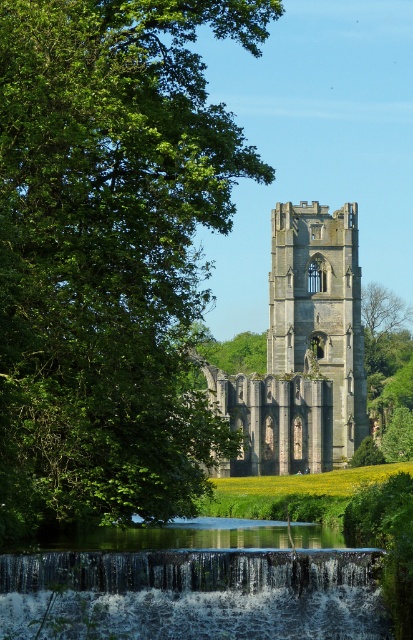
Is point (128, 248) closer to camera compared to point (130, 541)?

Yes, point (128, 248) is in front of point (130, 541).

Who is positioned more to the left, green leafy tree at upper left or translucent water cascade at lower center?

green leafy tree at upper left

Where is `green leafy tree at upper left`? The width and height of the screenshot is (413, 640). green leafy tree at upper left is located at coordinates (109, 252).

This screenshot has width=413, height=640. I want to click on green leafy tree at upper left, so click(x=109, y=252).

Is point (87, 593) farther from viewer compared to point (299, 426)?

No, it is not.

Which is above, translucent water cascade at lower center or stone tower at center?

stone tower at center is above.

Who is more distant from viewer, (40, 634) or (356, 282)?

Positioned behind is point (356, 282).

This screenshot has height=640, width=413. What are the coordinates of `translucent water cascade at lower center` in the screenshot? It's located at (197, 586).

From the picture: Is green leafy tree at upper left taller than stone tower at center?

Correct, green leafy tree at upper left is much taller as stone tower at center.

Does point (68, 163) come behind point (266, 472)?

That is False.

Where is `green leafy tree at upper left`? The height and width of the screenshot is (640, 413). green leafy tree at upper left is located at coordinates (109, 252).